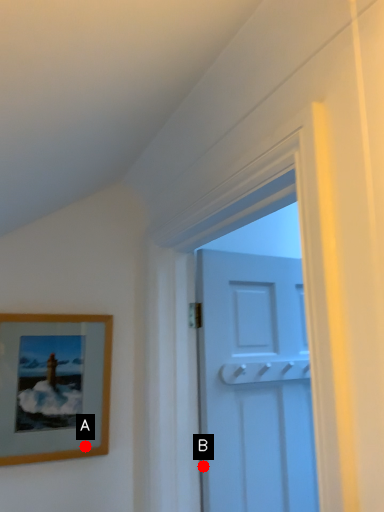
Question: Two points are circled on the image, labeled by A and B beside each circle. Which point appears farthest from the camera in this image?

Choices:
 (A) A is further
 (B) B is further

Answer: (B)